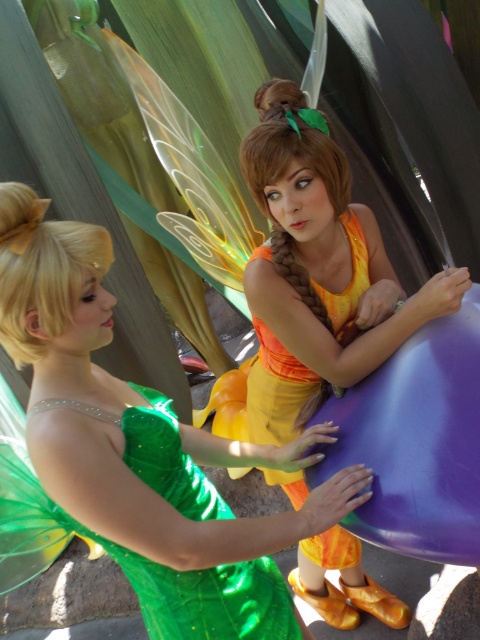
Question: Which is farther from the green satin dress at center?

Choices:
 (A) green shiny dress at center
 (B) matte orange dress at center

Answer: (B)

Question: Which point is closer to the camera?

Choices:
 (A) green shiny dress at center
 (B) matte orange dress at center
 (C) green satin dress at center

Answer: (C)

Question: Which of the following is the farthest from the observer?

Choices:
 (A) (130, 438)
 (B) (164, 573)

Answer: (B)

Question: Is green satin dress at center smaller than green shiny dress at center?

Choices:
 (A) no
 (B) yes

Answer: (A)

Question: Where is green satin dress at center located in relation to matte orange dress at center in the image?

Choices:
 (A) above
 (B) below

Answer: (B)

Question: Can you confirm if green satin dress at center is positioned below matte orange dress at center?

Choices:
 (A) yes
 (B) no

Answer: (A)